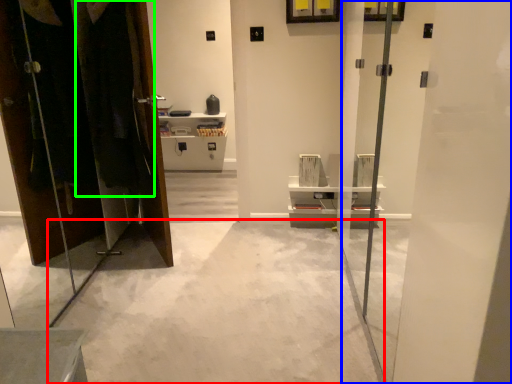
Question: Which object is positioned closest to concrete (highlighted by a red box)? Select from screen door (highlighted by a blue box) and laundry (highlighted by a green box).

Choices:
 (A) screen door
 (B) laundry

Answer: (A)